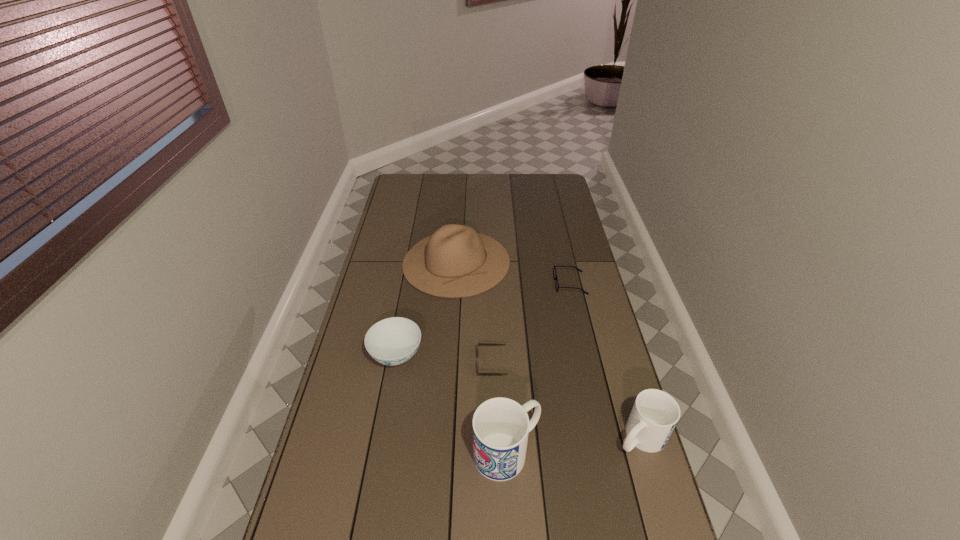
Image resolution: width=960 pixels, height=540 pixels. I want to click on vacant area between the shortest object and the shorter mug, so click(x=606, y=360).

The width and height of the screenshot is (960, 540). I want to click on vacant space in between the third tallest object and the sunglasses, so click(x=566, y=400).

Image resolution: width=960 pixels, height=540 pixels. Identify the location of unoccupied area between the sunglasses and the shortest object. (531, 323).

This screenshot has height=540, width=960. I want to click on free space between the chinaware and the sombrero, so click(x=426, y=309).

Where is `free point between the chinaware and the third tallest object`? free point between the chinaware and the third tallest object is located at coordinates (518, 396).

Locate an element on the screen. This screenshot has height=540, width=960. the second closest object to the fourth tallest object is located at coordinates click(x=455, y=261).

This screenshot has height=540, width=960. I want to click on object that is the fourth closest one to the third shortest object, so click(x=555, y=275).

Identify the location of free region that satisfies the following two spatial constraints: 1. on the front-facing side of the shorter mug; 2. on the left side of the shortest object. (606, 437).

Locate an element on the screen. free space that satisfies the following two spatial constraints: 1. on the back side of the fourth tallest object; 2. on the right side of the sombrero is located at coordinates (413, 262).

You are a GUI agent. You are given a task and a screenshot of the screen. Output one action in this format:
    pyautogui.click(x=<x>, y=<y>)
    Task: Click on the vacant position in the image that satisfies the following two spatial constraints: 1. on the front-facing side of the shortest object; 2. on the left side of the shorter mug
    
    Given the screenshot: What is the action you would take?
    pyautogui.click(x=606, y=437)